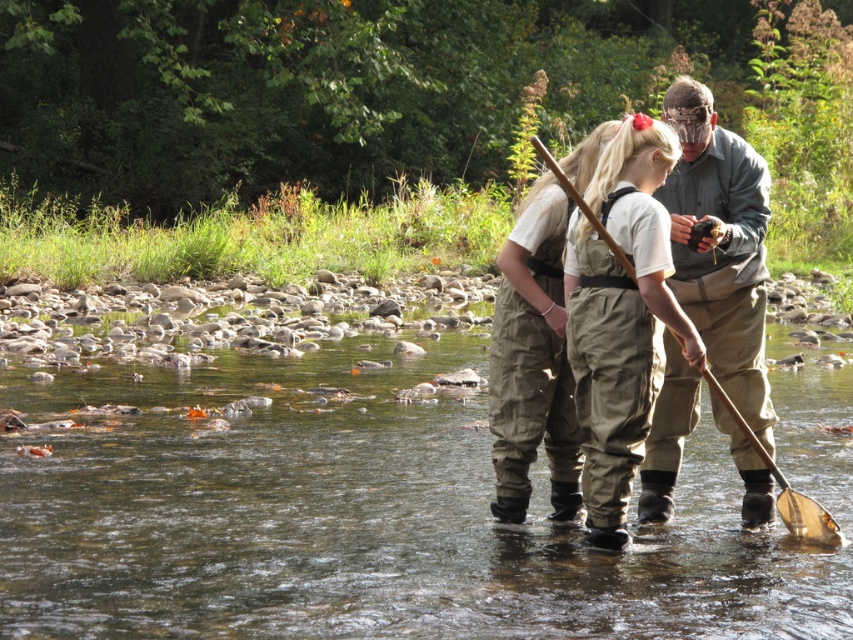
In the scene shown: Does camouflage-patterned waders at center have a lesser height compared to wooden paddle at center?

Incorrect, camouflage-patterned waders at center's height does not fall short of wooden paddle at center's.

Is camouflage-patterned waders at center further to the viewer compared to wooden paddle at center?

No.

Is point (741, 440) closer to camera compared to point (790, 516)?

No, (741, 440) is behind (790, 516).

Image resolution: width=853 pixels, height=640 pixels. In order to click on camouflage-patterned waders at center in this screenshot , I will do `click(720, 246)`.

Image resolution: width=853 pixels, height=640 pixels. What do you see at coordinates (355, 516) in the screenshot?
I see `clear water at river center` at bounding box center [355, 516].

Does clear water at river center appear under wooden paddle at center?

No.

Locate an element on the screen. Image resolution: width=853 pixels, height=640 pixels. clear water at river center is located at coordinates (355, 516).

Can you confirm if clear water at river center is taller than camouflage-patterned waders at center?

In fact, clear water at river center may be shorter than camouflage-patterned waders at center.

Is point (544, 493) positioned behind point (746, 365)?

Yes, point (544, 493) is behind point (746, 365).

The width and height of the screenshot is (853, 640). I want to click on clear water at river center, so click(355, 516).